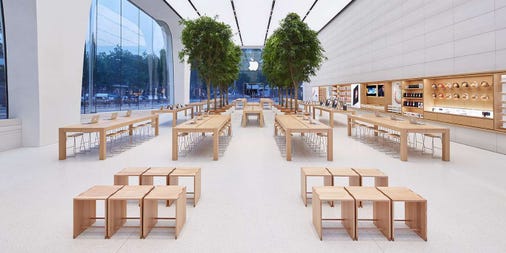
This screenshot has height=253, width=506. I want to click on glass windows, so click(x=136, y=26).